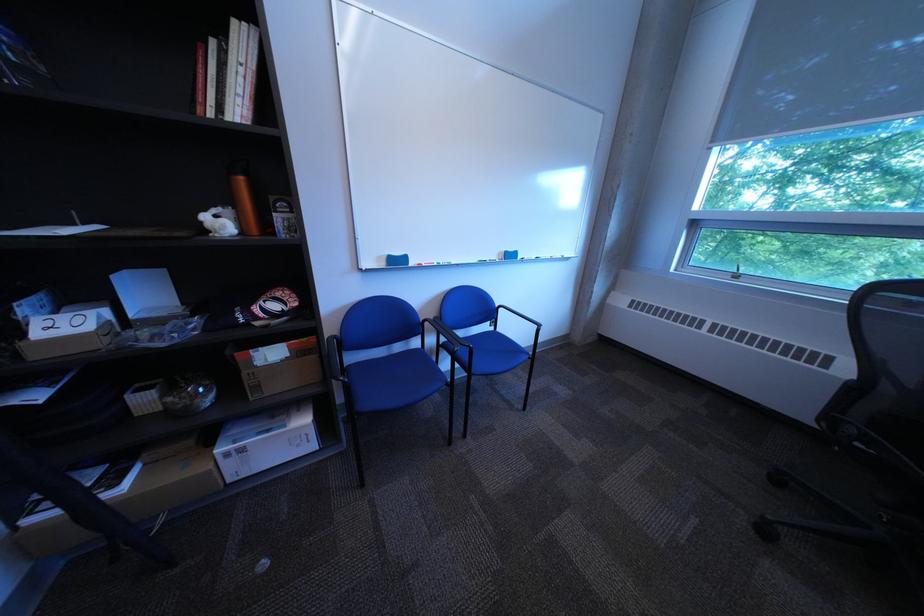
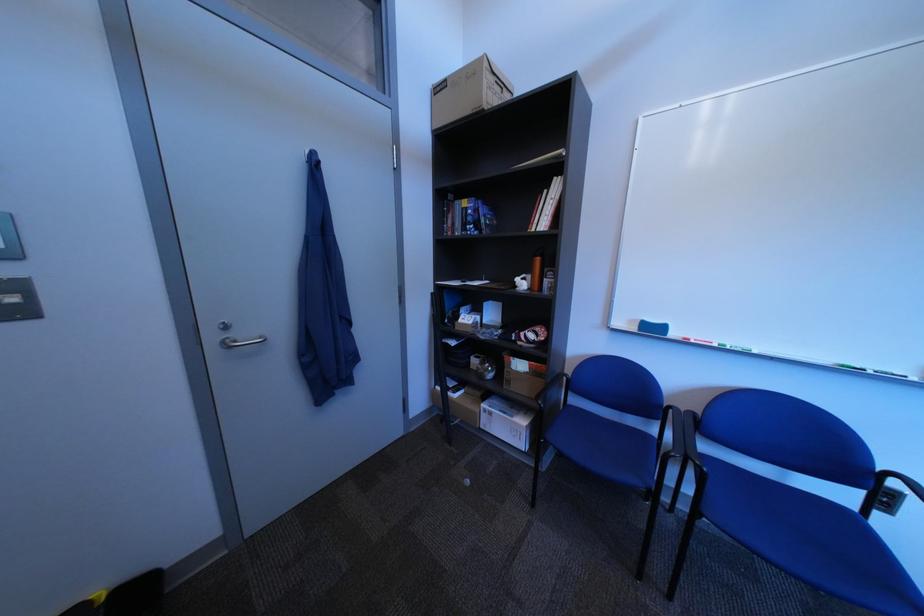
Where in the second image is the point corresponding to [245,483] from the first image?

(496, 429)